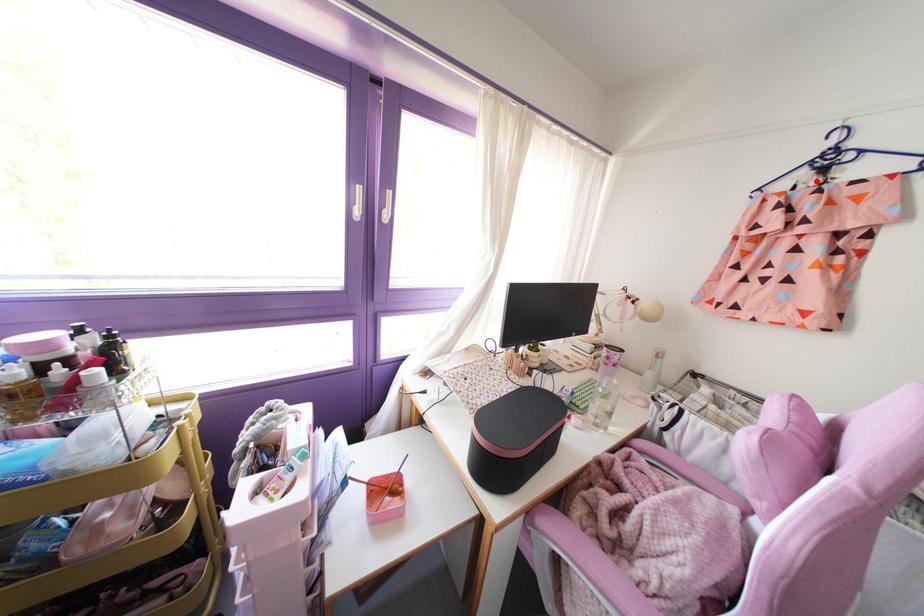
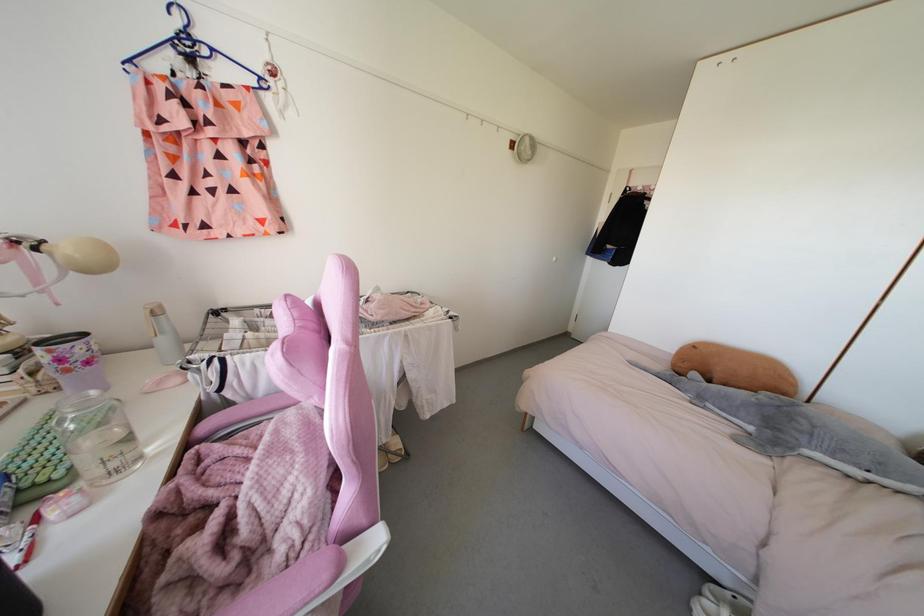
Where in the second image is the point corresponding to the highlighted location from the first image?

(191, 73)